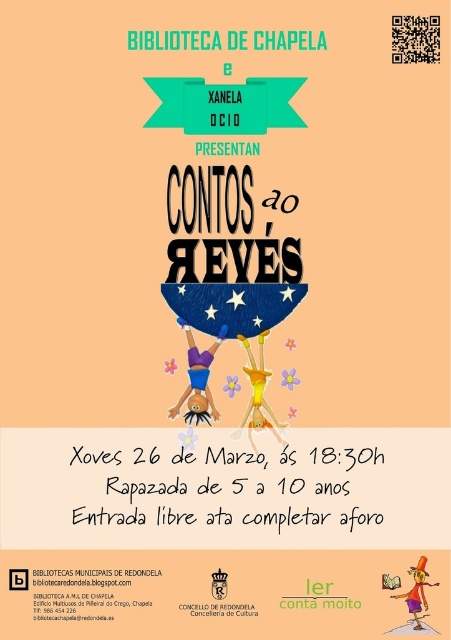
Question: Does greentextured ribbonbanner at upper center have a smaller size compared to redpapertext at center?

Choices:
 (A) no
 (B) yes

Answer: (A)

Question: Is black paper at lower left wider than redpapertext at center?

Choices:
 (A) yes
 (B) no

Answer: (A)

Question: Which point is closer to the camera?

Choices:
 (A) redpapertext at center
 (B) black paper at lower left

Answer: (A)

Question: Which object appears closest to the camera in this image?

Choices:
 (A) black paper at lower left
 (B) blacktexturedtext at center
 (C) redpapertext at center
 (D) greentextured ribbonbanner at upper center

Answer: (C)

Question: Which object appears farthest from the camera in this image?

Choices:
 (A) black paper text at center
 (B) black paper at lower left
 (C) blacktexturedtext at center

Answer: (A)

Question: Is greentextured ribbonbanner at upper center smaller than redpapertext at center?

Choices:
 (A) no
 (B) yes

Answer: (A)